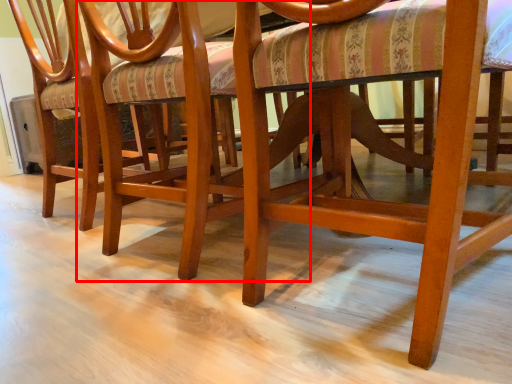
Question: Considering the relative positions of chair (annotated by the red box) and chair in the image provided, where is chair (annotated by the red box) located with respect to the staircase?

Choices:
 (A) left
 (B) right

Answer: (B)